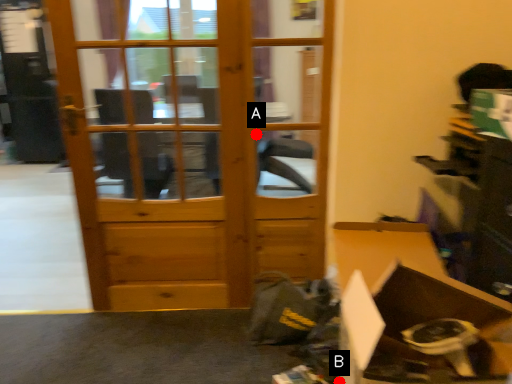
Question: Two points are circled on the image, labeled by A and B beside each circle. Which point is farther to the camera?

Choices:
 (A) A is further
 (B) B is further

Answer: (A)